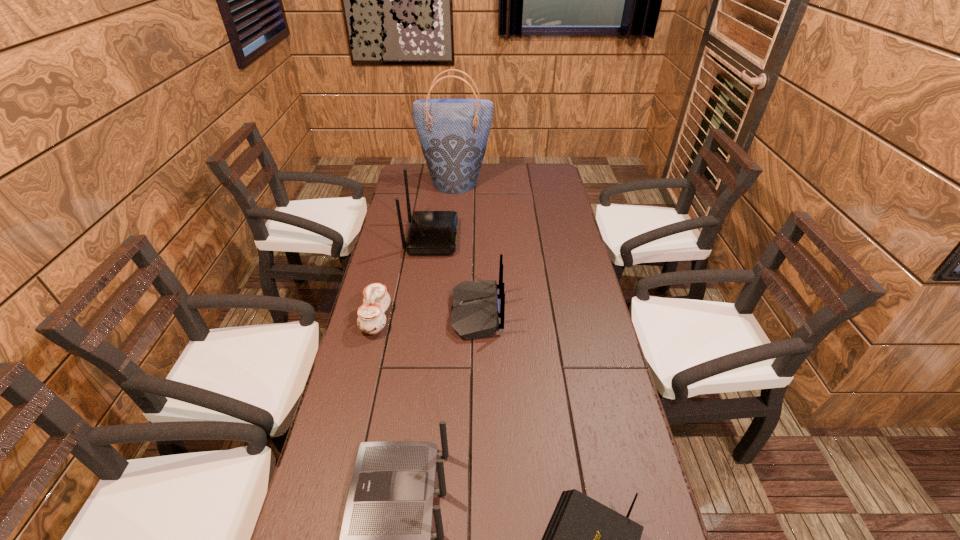
Identify the location of the farthest object. (453, 133).

The width and height of the screenshot is (960, 540). Find the location of `shopping bag`. shopping bag is located at coordinates (453, 133).

The height and width of the screenshot is (540, 960). I want to click on the second tallest object, so click(431, 232).

This screenshot has height=540, width=960. I want to click on the second farthest object, so [x=431, y=232].

You are a GUI agent. You are given a task and a screenshot of the screen. Output one action in this format:
    pyautogui.click(x=<x>, y=<y>)
    Task: Click on the second farthest router
    
    Given the screenshot: What is the action you would take?
    pyautogui.click(x=475, y=311)

Find the location of `chinaware`. chinaware is located at coordinates (371, 319).

The height and width of the screenshot is (540, 960). Find the location of `free space located 0.090m on the front of the tallest object`. free space located 0.090m on the front of the tallest object is located at coordinates (454, 205).

Locate an element on the screen. vacant space located 0.210m on the front-facing side of the fifth nearest object is located at coordinates (513, 238).

The image size is (960, 540). I want to click on vacant space located on the back of the third nearest router, so click(x=595, y=313).

This screenshot has width=960, height=540. I want to click on vacant space located by the handle of the second shortest object, so click(481, 320).